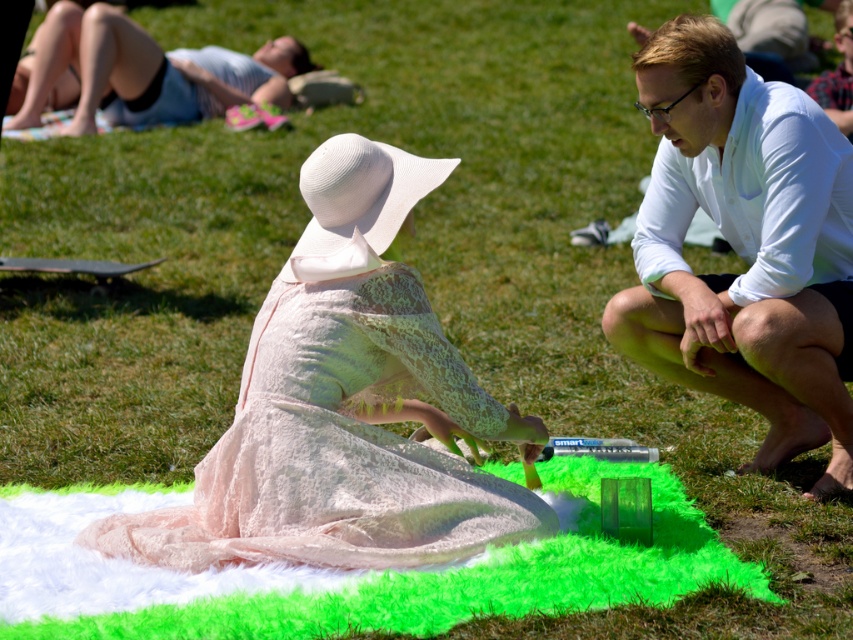
You are standing in the park and see the light pink lace dress at center and the fluffy white blanket at lower center. Which object is closer to you?

The light pink lace dress at center is closer to you because it is further to the viewer than the fluffy white blanket at lower center.

You are a photographer standing at the center of the scene. You want to capture a photo that includes both the person in the light pink lace dress and the white cotton shirt at right. What should you do to ensure both are in frame?

Move closer to the white cotton shirt at right so that both the person in the light pink lace dress and the white cotton shirt at right are within the camera frame, as they are 17.29 feet apart.